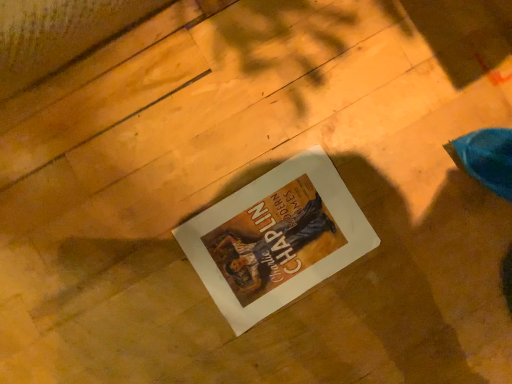
Locate an element on the screen. free space behind matte paper poster at center is located at coordinates (357, 146).